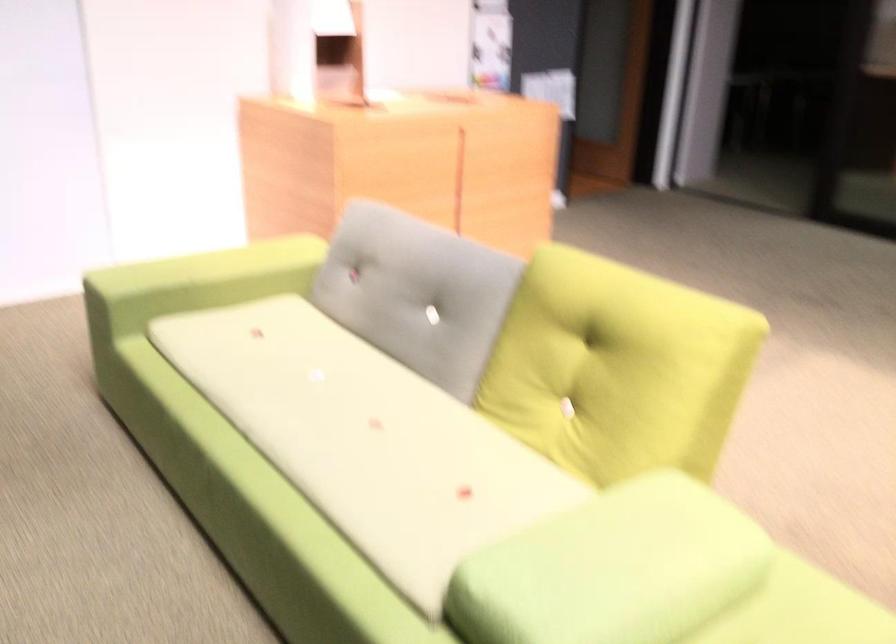
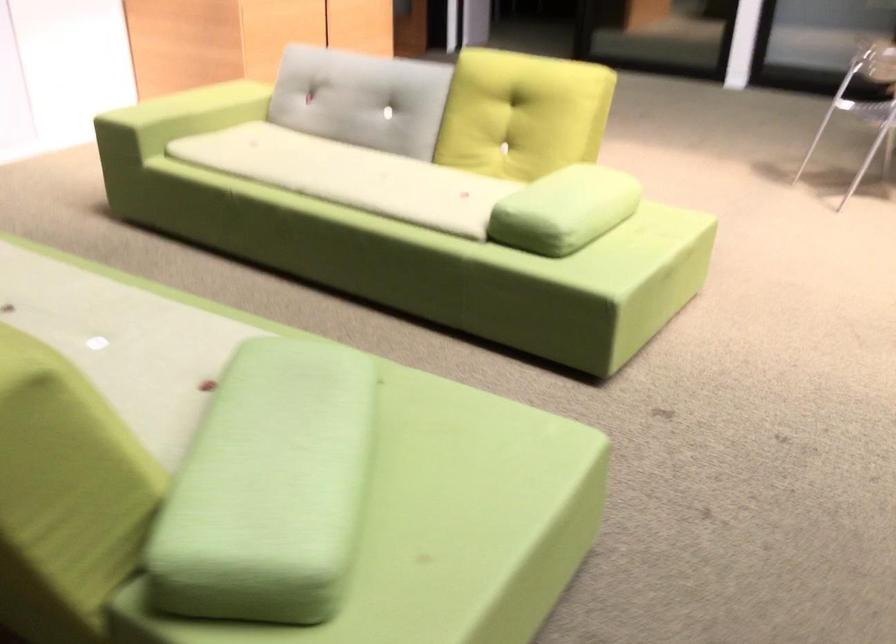
Where in the second image is the point corresponding to (x=317, y=422) from the first image?

(349, 176)